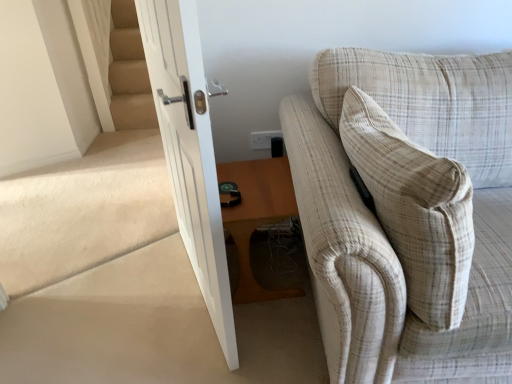
The height and width of the screenshot is (384, 512). Find the location of `free region on the left part of beige carpeted stairs at left`. free region on the left part of beige carpeted stairs at left is located at coordinates (49, 256).